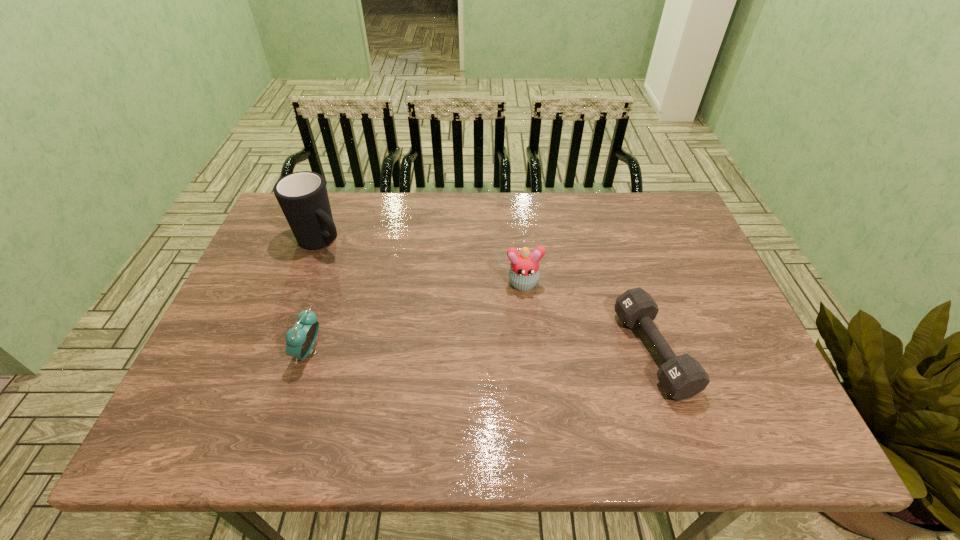
Locate an element on the screen. The width and height of the screenshot is (960, 540). free space located on the side of the farthest object with the handle is located at coordinates (359, 270).

Where is `vacant space located on the side of the farthest object with the handle`? vacant space located on the side of the farthest object with the handle is located at coordinates (433, 327).

This screenshot has width=960, height=540. Find the location of `vacant area situated 0.110m on the side of the farthest object with the handle`. vacant area situated 0.110m on the side of the farthest object with the handle is located at coordinates (361, 272).

At what (x,y) coordinates should I click in order to perform the action: click on free space located 0.130m on the face of the cupcake. Please return your answer as a coordinate pair (x, y). Image resolution: width=960 pixels, height=540 pixels. Looking at the image, I should click on tap(529, 334).

Find the location of `vacant space located on the face of the cupcake`. vacant space located on the face of the cupcake is located at coordinates (528, 321).

This screenshot has width=960, height=540. What are the coordinates of `vacant area located 0.100m on the face of the cupcake` in the screenshot? It's located at (528, 325).

This screenshot has height=540, width=960. I want to click on object present at the far edge, so click(302, 196).

Where is `object at the near edge`? The height and width of the screenshot is (540, 960). object at the near edge is located at coordinates (682, 377).

Identify the location of object positioned at the left edge. Image resolution: width=960 pixels, height=540 pixels. (302, 196).

Identify the location of object that is at the right edge. The width and height of the screenshot is (960, 540). (682, 377).